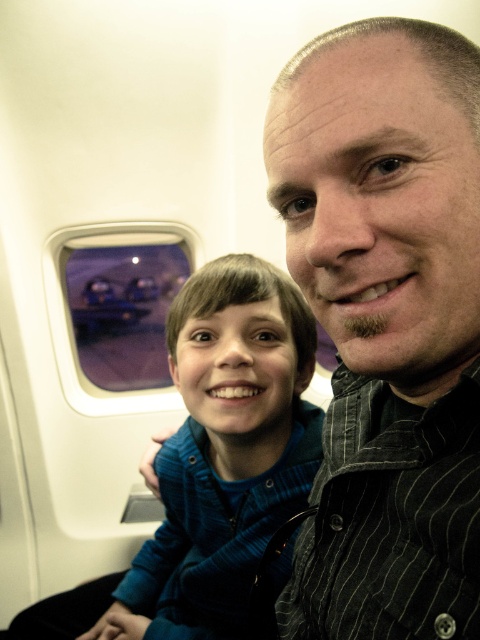
In the scene shown: Can you confirm if black striped shirt at upper right is bigger than transparent glass airplane window at upper left?

No.

Does black striped shirt at upper right have a lesser height compared to transparent glass airplane window at upper left?

Indeed, black striped shirt at upper right has a lesser height compared to transparent glass airplane window at upper left.

Image resolution: width=480 pixels, height=640 pixels. Describe the element at coordinates (386, 324) in the screenshot. I see `black striped shirt at upper right` at that location.

Find the location of `black striped shirt at upper right`. black striped shirt at upper right is located at coordinates (386, 324).

From the picture: Which is below, black striped shirt at upper right or blue striped shirt at center?

blue striped shirt at center is below.

Does point (429, 540) come in front of point (252, 387)?

Yes, point (429, 540) is in front of point (252, 387).

In order to click on black striped shirt at upper right in this screenshot , I will do `click(386, 324)`.

Does blue striped shirt at center have a greater height compared to transparent glass airplane window at upper left?

In fact, blue striped shirt at center may be shorter than transparent glass airplane window at upper left.

Which is more to the right, blue striped shirt at center or transparent glass airplane window at upper left?

From the viewer's perspective, blue striped shirt at center appears more on the right side.

This screenshot has width=480, height=640. Describe the element at coordinates (225, 448) in the screenshot. I see `blue striped shirt at center` at that location.

Where is `blue striped shirt at center`? The width and height of the screenshot is (480, 640). blue striped shirt at center is located at coordinates (225, 448).